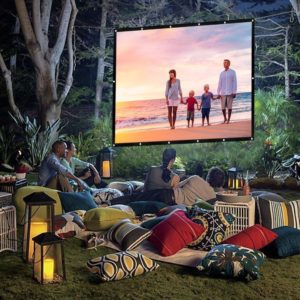
Identify the location of lanterns. The width and height of the screenshot is (300, 300). (56, 263), (39, 225), (102, 168), (237, 173).